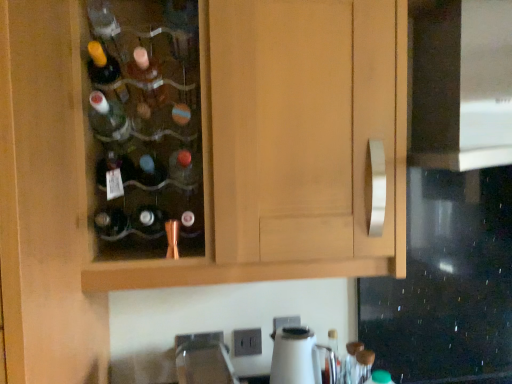
You are a GUI agent. You are given a task and a screenshot of the screen. Output one action in this format:
    pyautogui.click(x=<x>, y=<y>)
    Task: Click on the black glass oven at right
    
    Given the screenshot: What is the action you would take?
    pyautogui.click(x=462, y=85)

The image size is (512, 384). Find the location of `matte glass bottle at center`. matte glass bottle at center is located at coordinates (183, 169).

How far apart are matte glass bottle at center and white glossy kettle at lower center?

22.53 inches.

Is matte glass bottle at center directly adjacent to white glossy kettle at lower center?

No.

Based on the photo, is matte glass bottle at center located outside white glossy kettle at lower center?

Yes, matte glass bottle at center is outside of white glossy kettle at lower center.

Does point (179, 166) come in front of point (284, 362)?

That is False.

From a real-world perspective, who is located higher, white glossy kettle at lower center or wooden cabinet at center?

In real-world perspective, wooden cabinet at center is above.

Is point (302, 366) closer to viewer compared to point (356, 184)?

No, (302, 366) is behind (356, 184).

Which object is wider, white glossy kettle at lower center or wooden cabinet at center?

With larger width is wooden cabinet at center.

Considering the sizes of objects white glossy kettle at lower center and wooden cabinet at center in the image provided, who is shorter, white glossy kettle at lower center or wooden cabinet at center?

With less height is white glossy kettle at lower center.

Which point is more forward, (211, 351) or (283, 379)?

Positioned in front is point (211, 351).

I want to click on faucet that appears above the white glossy kettle at lower center (from the image's perspective), so click(x=204, y=363).

Is satin nickel faucet at lower center at the left side of white glossy kettle at lower center?

Yes, satin nickel faucet at lower center is to the left of white glossy kettle at lower center.

Between wooden cabinet at center and matte glass bottle at center, which one is positioned behind?

matte glass bottle at center is further from the camera.

From the image's perspective, which is below, wooden cabinet at center or matte glass bottle at center?

matte glass bottle at center is shown below in the image.

What's the angular difference between wooden cabinet at center and matte glass bottle at center's facing directions?

0.465 degrees separate the facing orientations of wooden cabinet at center and matte glass bottle at center.

Considering the positions of objects wooden cabinet at center and matte glass bottle at center in the image provided, who is more to the right, wooden cabinet at center or matte glass bottle at center?

Answer: wooden cabinet at center is more to the right.

Measure the distance between wooden cabinet at center and satin nickel faucet at lower center.

wooden cabinet at center is 20.10 inches away from satin nickel faucet at lower center.

From a real-world perspective, which object rests below the other?

satin nickel faucet at lower center is physically lower.

Locate an element on the screen. The width and height of the screenshot is (512, 384). cabinetry that appears on the right of satin nickel faucet at lower center is located at coordinates (294, 145).

Which is closer to the camera, (241, 81) or (218, 350)?

The point (241, 81) is closer.

Would you say white glossy kettle at lower center is to the left or to the right of satin nickel faucet at lower center in the picture?

Clearly, white glossy kettle at lower center is on the right of satin nickel faucet at lower center in the image.

Which is correct: white glossy kettle at lower center is inside satin nickel faucet at lower center, or outside of it?

white glossy kettle at lower center is spatially situated outside satin nickel faucet at lower center.

The image size is (512, 384). I want to click on appliance directly beneath the satin nickel faucet at lower center (from a real-world perspective), so click(298, 357).

From the image's perspective, does white glossy kettle at lower center appear lower than satin nickel faucet at lower center?

Indeed, from the image's perspective, white glossy kettle at lower center is shown beneath satin nickel faucet at lower center.

Considering the relative positions of satin nickel faucet at lower center and wooden cabinet at center in the image provided, is satin nickel faucet at lower center to the left or to the right of wooden cabinet at center?

satin nickel faucet at lower center is positioned on wooden cabinet at center's left side.

What's the angular difference between satin nickel faucet at lower center and wooden cabinet at center's facing directions?

There is a 0.095-degree angle between the facing directions of satin nickel faucet at lower center and wooden cabinet at center.

How distant is satin nickel faucet at lower center from wooden cabinet at center?

20.10 inches.

From a real-world perspective, is satin nickel faucet at lower center positioned above or below wooden cabinet at center?

satin nickel faucet at lower center is below wooden cabinet at center.

Locate an element on the screen. Image resolution: width=512 pixels, height=384 pixels. appliance on the right of matte glass bottle at center is located at coordinates (298, 357).

Identify the location of appliance below the wooden cabinet at center (from a real-world perspective). The image size is (512, 384). (298, 357).

Considering their positions, is satin nickel faucet at lower center positioned closer to black glass oven at right than white glossy kettle at lower center?

Based on the image, white glossy kettle at lower center appears to be nearer to black glass oven at right.

Based on their spatial positions, is matte glass bottle at center or black glass oven at right closer to wooden cabinet at center?

Among the two, black glass oven at right is located nearer to wooden cabinet at center.

From the image, which object appears to be farther from matte glass bottle at center, white glossy kettle at lower center or satin nickel faucet at lower center?

white glossy kettle at lower center lies further to matte glass bottle at center than the other object.

Looking at the image, which one is located closer to black glass oven at right, white glossy kettle at lower center or wooden cabinet at center?

wooden cabinet at center lies closer to black glass oven at right than the other object.

From the image, which object appears to be nearer to wooden cabinet at center, matte glass bottle at center or white glossy kettle at lower center?

Based on the image, matte glass bottle at center appears to be nearer to wooden cabinet at center.

Considering their positions, is white glossy kettle at lower center positioned further to black glass oven at right than matte glass bottle at center?

white glossy kettle at lower center is further to black glass oven at right.

Estimate the real-world distances between objects in this image. Which object is closer to wooden cabinet at center, white glossy kettle at lower center or black glass oven at right?

The object closer to wooden cabinet at center is black glass oven at right.

When comparing their distances from satin nickel faucet at lower center, does matte glass bottle at center or black glass oven at right seem further?

Based on the image, black glass oven at right appears to be further to satin nickel faucet at lower center.

Where is `bottle between wooden cabinet at center and satin nickel faucet at lower center from top to bottom`? This screenshot has width=512, height=384. bottle between wooden cabinet at center and satin nickel faucet at lower center from top to bottom is located at coordinates (183, 169).

Locate an element on the screen. This screenshot has width=512, height=384. cabinetry between black glass oven at right and satin nickel faucet at lower center in the up-down direction is located at coordinates (294, 145).

You are a GUI agent. You are given a task and a screenshot of the screen. Output one action in this format:
    pyautogui.click(x=<x>, y=<y>)
    Task: Click on the bottle between black glass oven at right and white glossy kettle at lower center in the up-down direction
    This screenshot has width=512, height=384.
    Given the screenshot: What is the action you would take?
    pyautogui.click(x=183, y=169)

Image resolution: width=512 pixels, height=384 pixels. In order to click on faucet between matte glass bottle at center and white glossy kettle at lower center in the vertical direction in this screenshot , I will do `click(204, 363)`.